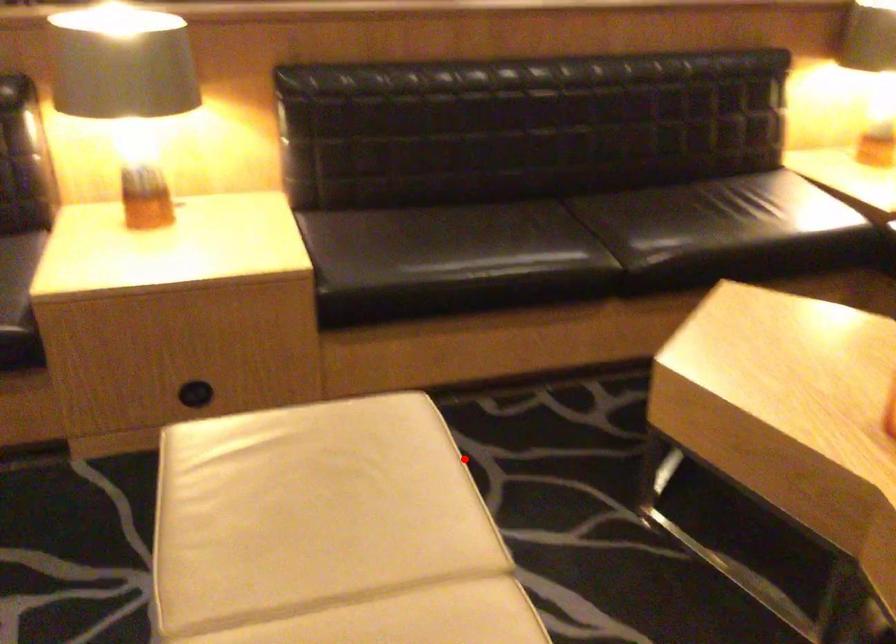
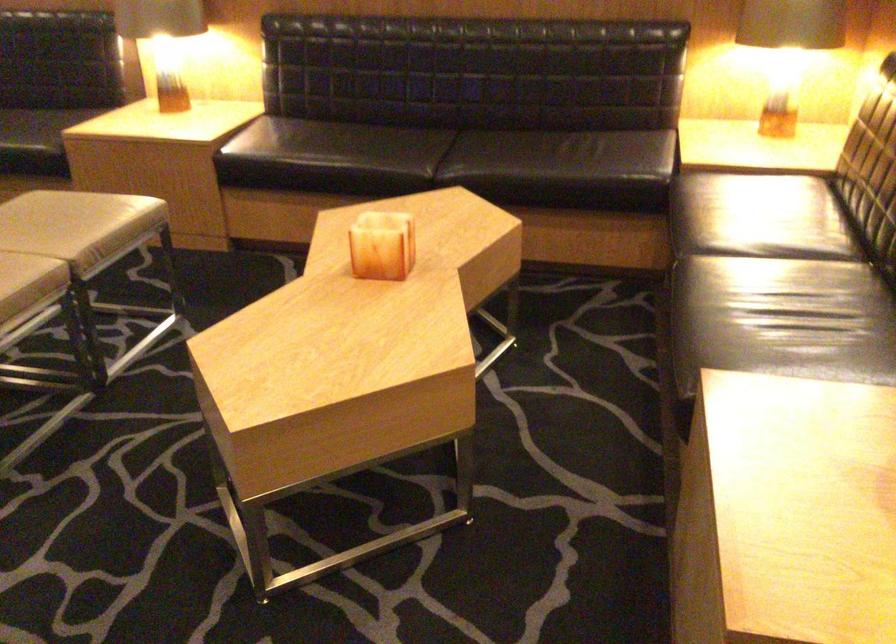
Locate, in the second image, the point that corresponds to the highlighted location in the first image.

(70, 223)